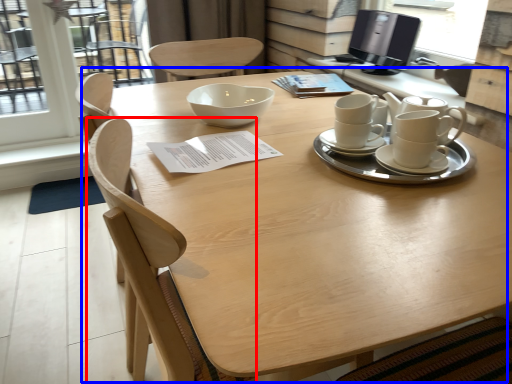
Question: Which point is closer to the camera, chair (highlighted by a red box) or table (highlighted by a blue box)?

Choices:
 (A) chair
 (B) table

Answer: (B)